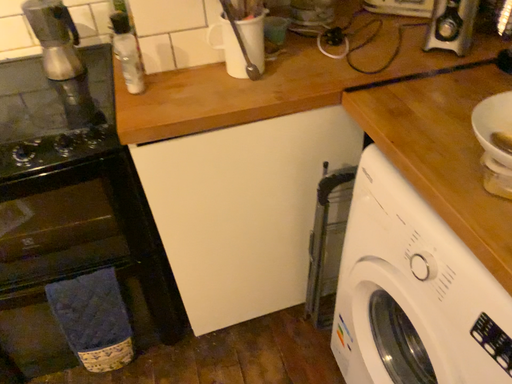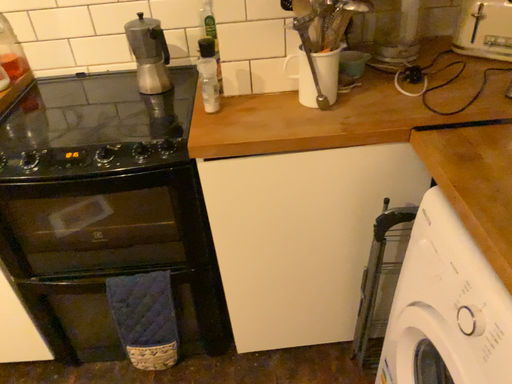
Question: Which way did the camera rotate in the video?

Choices:
 (A) rotated right
 (B) rotated left

Answer: (B)